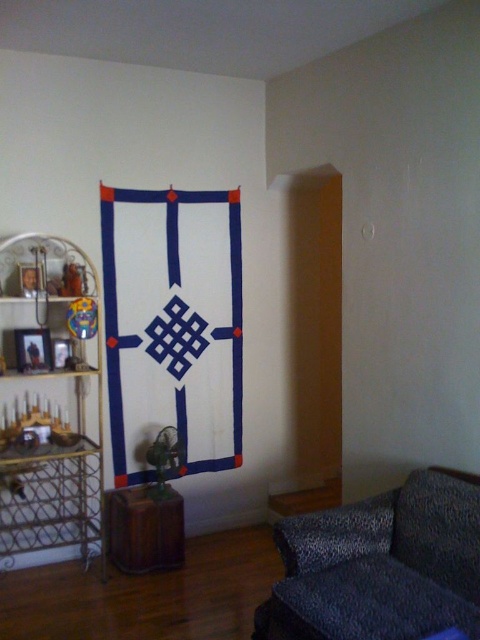
Who is taller, leopard print fabric couch at lower right or brown wooden stool at lower left?

leopard print fabric couch at lower right

Describe the element at coordinates (380, 564) in the screenshot. The width and height of the screenshot is (480, 640). I see `leopard print fabric couch at lower right` at that location.

Image resolution: width=480 pixels, height=640 pixels. What are the coordinates of `leopard print fabric couch at lower right` in the screenshot? It's located at (380, 564).

Who is positioned more to the left, metallic gold shelving unit at left or brown wooden stool at lower left?

Positioned to the left is metallic gold shelving unit at left.

The height and width of the screenshot is (640, 480). What do you see at coordinates (49, 404) in the screenshot?
I see `metallic gold shelving unit at left` at bounding box center [49, 404].

You are a GUI agent. You are given a task and a screenshot of the screen. Output one action in this format:
    pyautogui.click(x=<x>, y=<y>)
    Task: Click on the metallic gold shelving unit at left
    This screenshot has height=640, width=480.
    Given the screenshot: What is the action you would take?
    pyautogui.click(x=49, y=404)

Is leopard print fabric couch at lower right shorter than metallic gold shelving unit at left?

Yes, leopard print fabric couch at lower right is shorter than metallic gold shelving unit at left.

Measure the distance between point (334, 586) and camera.

They are 7.41 feet apart.

Measure the distance between leopard print fabric couch at lower right and camera.

leopard print fabric couch at lower right and camera are 1.93 meters apart from each other.

Where is `leopard print fabric couch at lower right`? Image resolution: width=480 pixels, height=640 pixels. leopard print fabric couch at lower right is located at coordinates (380, 564).